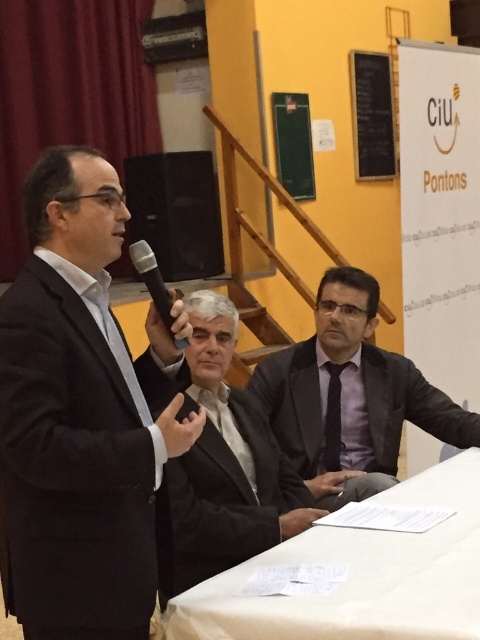
Question: Does dark gray suit at center come in front of black matte speaker at upper center?

Choices:
 (A) no
 (B) yes

Answer: (B)

Question: Which object appears closest to the camera in this image?

Choices:
 (A) purple satin suit at center
 (B) black chalkboard at upper right
 (C) white cloth at lower center
 (D) black matte suit at left

Answer: (C)

Question: Which object is positioned farthest from the green matte board at upper center?

Choices:
 (A) black matte speaker at upper center
 (B) black matte suit at left

Answer: (B)

Question: Can you confirm if black chalkboard at upper right is thinner than green matte board at upper center?

Choices:
 (A) yes
 (B) no

Answer: (B)

Question: Which point appears closest to the camera in this image?

Choices:
 (A) (370, 97)
 (B) (343, 336)
 (C) (160, 522)
 (D) (144, 248)

Answer: (D)

Question: Does dark gray suit at center have a lesser width compared to black silk tie at center?

Choices:
 (A) yes
 (B) no

Answer: (B)